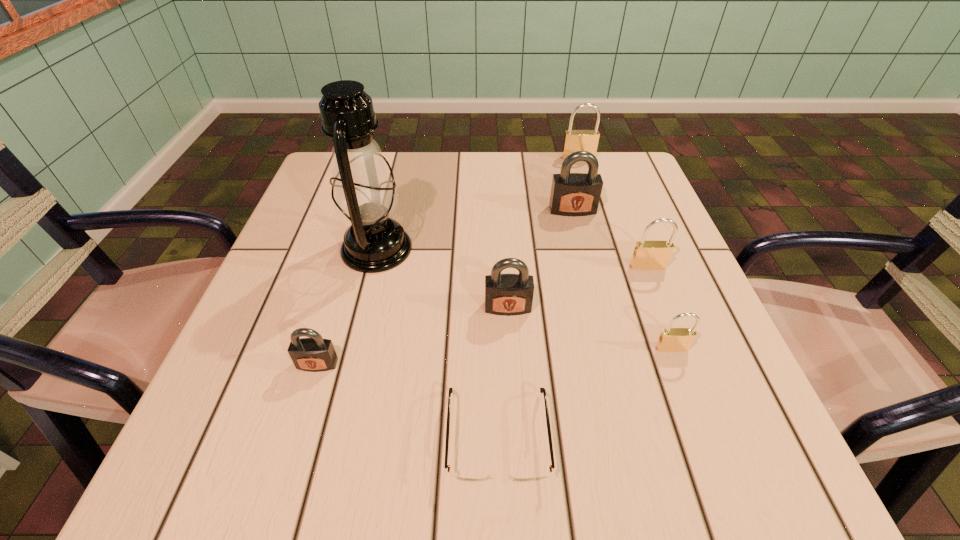
You are a GUI agent. You are given a task and a screenshot of the screen. Output one action in this format:
    pyautogui.click(x=<x>, y=<y>)
    Task: Click on the vacant region between the spectacles and the nearest brass padlock
    The height and width of the screenshot is (540, 960).
    Given the screenshot: What is the action you would take?
    pyautogui.click(x=585, y=393)

You are a GUI agent. You are given a task and a screenshot of the screen. Output one action in this format:
    pyautogui.click(x=<x>, y=<y>)
    Task: Click on the free spot between the second padlock from left to right and the farthest brass padlock
    
    Given the screenshot: What is the action you would take?
    pyautogui.click(x=543, y=233)

The width and height of the screenshot is (960, 540). I want to click on vacant point located between the smallest brass padlock and the second farthest object, so click(622, 279).

Locate which object ranks fifth in proximity to the smallest brass padlock. Please provide its 2D coordinates. Your answer should be formatted as a tuple, i.e. [(x, y)], where the tuple contains the x and y coordinates of a point satisfying the conditions above.

[(364, 194)]

Identify the location of object that stands as the fifth closest to the farthest object. The image size is (960, 540). point(671,339).

Locate an element on the screen. This screenshot has height=540, width=960. padlock that stands as the fifth closest to the spectacles is located at coordinates (572, 194).

Identify which padlock is the fifth nearest to the second gray padlock from left to right. Please provide its 2D coordinates. Your answer should be formatted as a tuple, i.e. [(x, y)], where the tuple contains the x and y coordinates of a point satisfying the conditions above.

[(575, 140)]

Locate an element on the screen. The image size is (960, 540). brass padlock that is the third closest to the second smallest gray padlock is located at coordinates (575, 140).

I want to click on the third closest brass padlock to the biggest gray padlock, so click(671, 339).

Select which gray padlock appears as the closest to the tallest object. Please provide its 2D coordinates. Your answer should be formatted as a tuple, i.e. [(x, y)], where the tuple contains the x and y coordinates of a point satisfying the conditions above.

[(508, 294)]